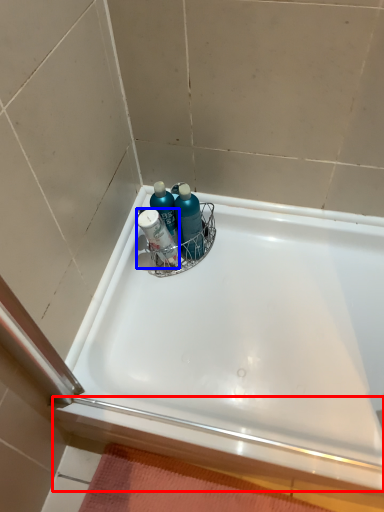
Question: Which point is closer to the camera, ledge (highlighted by a red box) or mouthwash (highlighted by a blue box)?

Choices:
 (A) ledge
 (B) mouthwash

Answer: (A)